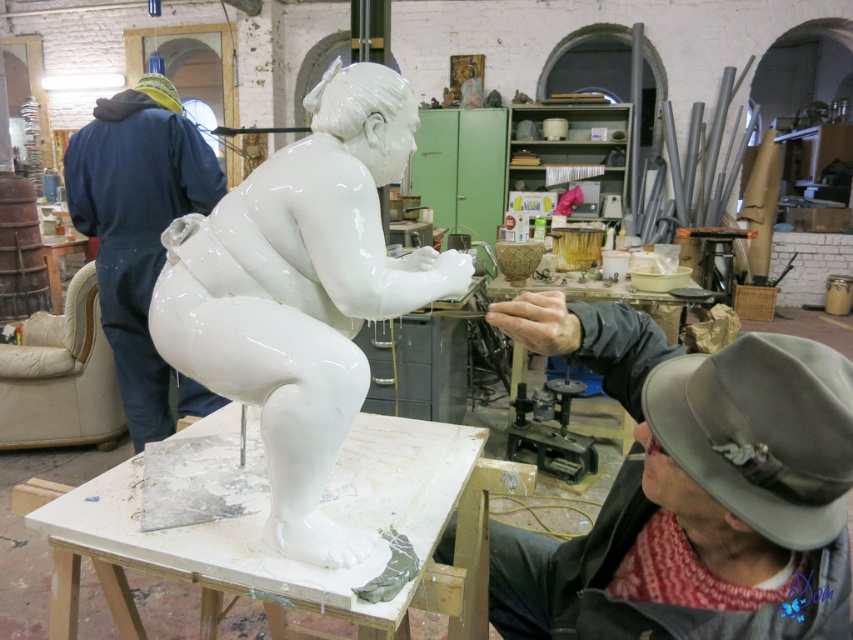
You are an artist who needs to place a protective cover over both the white glossy statue at center and the gray felt fedora at lower right. Given their sizes, which object requires a larger cover?

The white glossy statue at center requires a larger cover because it is larger in size than the gray felt fedora at lower right.

You are a photographer standing at the camera position. You want to place a small tripod between the gray felt fedora at lower right and the camera to take a photo. The tripod requires at least 24 inches of space. Is there enough space?

The distance between the gray felt fedora at lower right and the camera is 24.40 inches, which is just enough space to place the tripod since it requires at least 24 inches.

You are an observer standing in front of the workshop scene. You notice the gray felt fedora at lower right and the blue denim jumpsuit at left. Which object is shorter in height?

The gray felt fedora at lower right is not as tall as the blue denim jumpsuit at left, so the gray felt fedora at lower right is shorter in height.